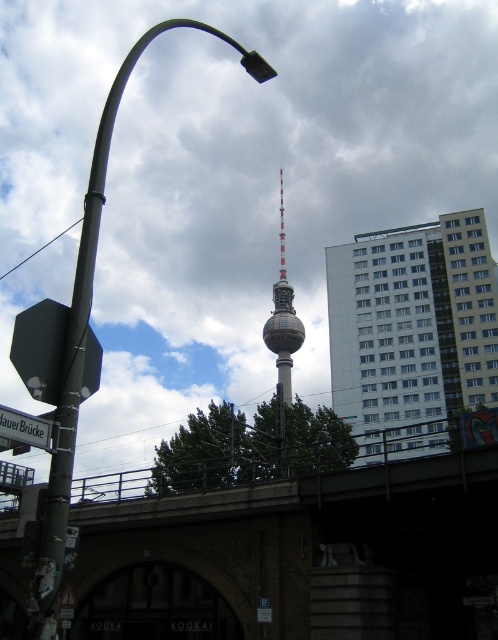
You are a tourist standing at the base of the Berlin TV Tower and see the white glass building at upper right and the white plastic street sign at lower left in the distance. Which object appears closer to you in the image?

The white plastic street sign at lower left appears closer because it is positioned above the white glass building at upper right, which is placed further back in the scene.

You are a tourist standing at the base of the Berlin TV Tower. You see a brick bridge at center and a white glass building at upper right. Which object is closer to your left side?

The brick bridge at center is to the left of the white glass building at upper right, so it is closer to your left side.

You are a tourist standing at the base of the Berlin TV Tower and want to take a photo that includes both the brick bridge at center and the white glass building at upper right. Which object should appear smaller in your photo?

The brick bridge at center should appear smaller in the photo because it is shorter than the white glass building at upper right.